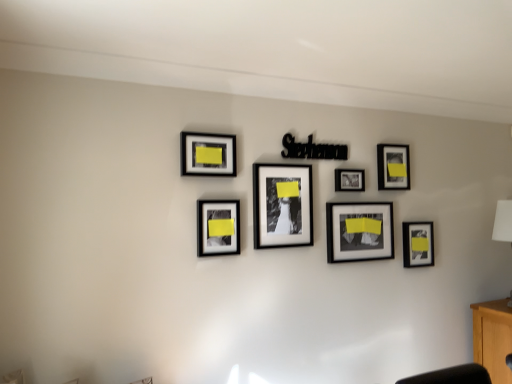
Question: Does beech wood cabinet at lower right have a lesser height compared to white fabric lampshade at right?

Choices:
 (A) no
 (B) yes

Answer: (B)

Question: Does beech wood cabinet at lower right appear on the left side of white fabric lampshade at right?

Choices:
 (A) no
 (B) yes

Answer: (A)

Question: Does beech wood cabinet at lower right have a greater width compared to white fabric lampshade at right?

Choices:
 (A) no
 (B) yes

Answer: (B)

Question: From the image's perspective, does beech wood cabinet at lower right appear lower than white fabric lampshade at right?

Choices:
 (A) yes
 (B) no

Answer: (A)

Question: From a real-world perspective, is beech wood cabinet at lower right on white fabric lampshade at right?

Choices:
 (A) no
 (B) yes

Answer: (A)

Question: Would you say matte black frame at lower right, which appears as the seventh picture frame when viewed from the left, is inside or outside matte black picture frame at upper right, positioned as the sixth picture frame in left-to-right order?

Choices:
 (A) inside
 (B) outside

Answer: (B)

Question: Is matte black frame at lower right, which appears as the seventh picture frame when viewed from the left, in front of or behind matte black picture frame at upper right, positioned as the sixth picture frame in left-to-right order, in the image?

Choices:
 (A) front
 (B) behind

Answer: (B)

Question: Visually, is matte black frame at lower right, which is the 1th picture frame from right to left, positioned to the left or to the right of matte black picture frame at upper right, which is the 2th picture frame in right-to-left order?

Choices:
 (A) left
 (B) right

Answer: (B)

Question: From a real-world perspective, is matte black frame at lower right, which is the 1th picture frame from right to left, positioned above or below matte black picture frame at upper right, which is the 2th picture frame in right-to-left order?

Choices:
 (A) below
 (B) above

Answer: (A)

Question: Is matte black photo frame at center, the 3th picture frame from the left, bigger or smaller than matte black picture frame at upper right, positioned as the sixth picture frame in left-to-right order?

Choices:
 (A) small
 (B) big

Answer: (B)

Question: From a real-world perspective, is matte black photo frame at center, the fifth picture frame when ordered from right to left, physically located above or below matte black picture frame at upper right, positioned as the sixth picture frame in left-to-right order?

Choices:
 (A) below
 (B) above

Answer: (A)

Question: Considering the positions of matte black photo frame at center, the 3th picture frame from the left, and matte black picture frame at upper right, which is the 2th picture frame in right-to-left order, in the image, is matte black photo frame at center, the 3th picture frame from the left, taller or shorter than matte black picture frame at upper right, which is the 2th picture frame in right-to-left order,?

Choices:
 (A) short
 (B) tall

Answer: (B)

Question: In terms of width, does matte black photo frame at center, the 3th picture frame from the left, look wider or thinner when compared to matte black picture frame at upper right, positioned as the sixth picture frame in left-to-right order?

Choices:
 (A) wide
 (B) thin

Answer: (A)

Question: From their relative heights in the image, would you say beech wood cabinet at lower right is taller or shorter than black matte picture frame at center, marked as the 4th picture frame in a left-to-right arrangement?

Choices:
 (A) tall
 (B) short

Answer: (A)

Question: From a real-world perspective, relative to black matte picture frame at center, the 4th picture frame when ordered from right to left, is beech wood cabinet at lower right vertically above or below?

Choices:
 (A) above
 (B) below

Answer: (B)